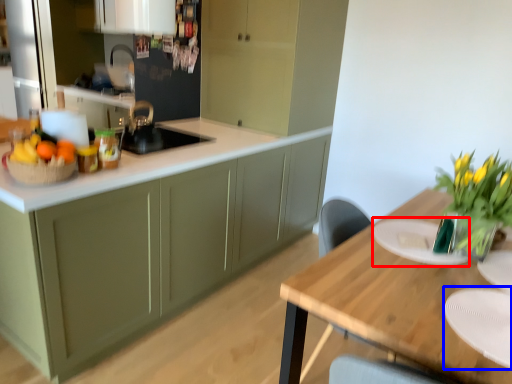
Question: Which point is further to the camera, plate (highlighted by a red box) or plate (highlighted by a blue box)?

Choices:
 (A) plate
 (B) plate

Answer: (A)